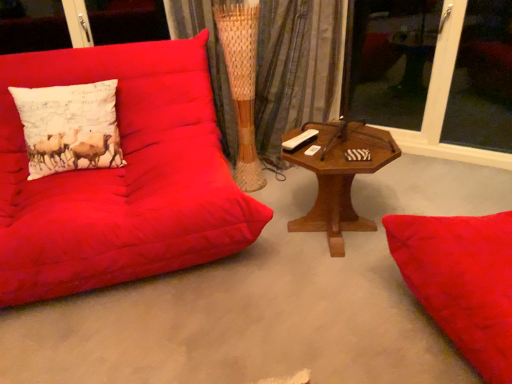
Identify the location of free point behind woodenobject at center. The image size is (512, 384). (316, 186).